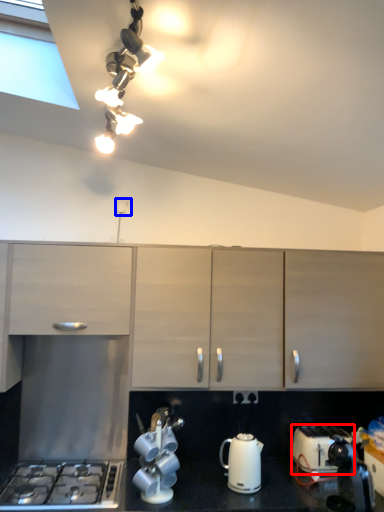
Question: Which object is further to the camera taking this photo, toaster (highlighted by a red box) or electric outlet (highlighted by a blue box)?

Choices:
 (A) toaster
 (B) electric outlet

Answer: (B)